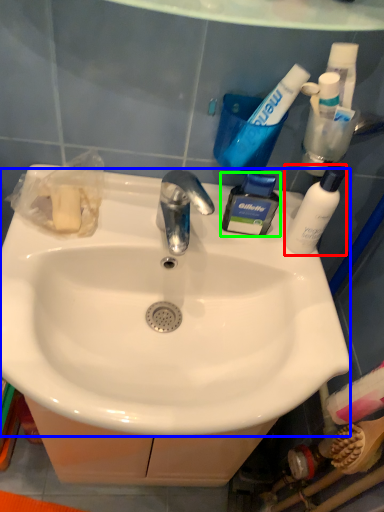
Question: Which object is positioned farthest from bottle (highlighted by a red box)? Select from sink (highlighted by a blue box) and toiletry (highlighted by a green box).

Choices:
 (A) sink
 (B) toiletry

Answer: (A)